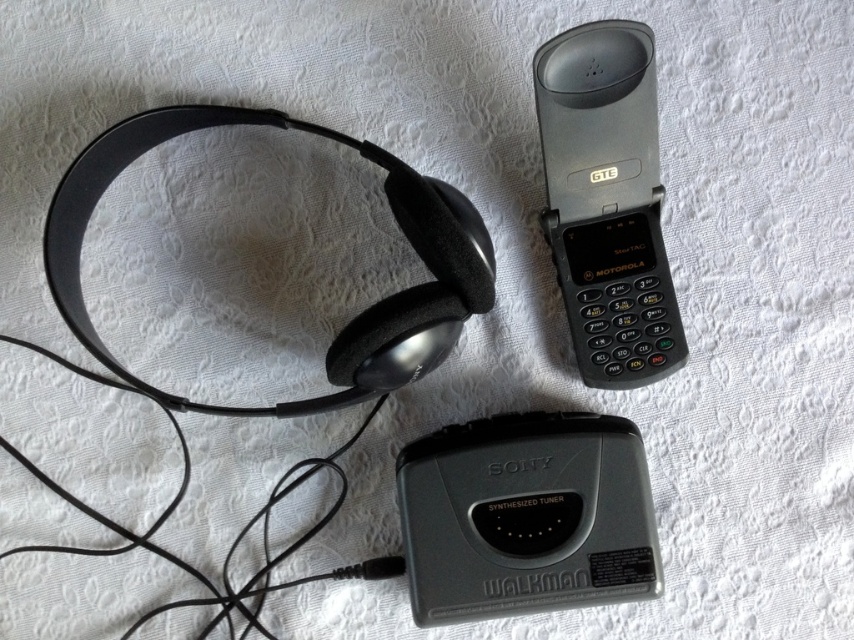
Question: Is gray matte walkman at center positioned before black plastic phone at upper right?

Choices:
 (A) no
 (B) yes

Answer: (A)

Question: Is gray matte walkman at center above matte black headphones at upper left?

Choices:
 (A) yes
 (B) no

Answer: (B)

Question: Which of these objects is positioned farthest from the gray matte walkman at center?

Choices:
 (A) matte black headphones at upper left
 (B) black plastic phone at upper right

Answer: (A)

Question: Which point is closer to the camera taking this photo?

Choices:
 (A) (560, 156)
 (B) (442, 260)

Answer: (A)

Question: Which point appears farthest from the camera in this image?

Choices:
 (A) (642, 131)
 (B) (401, 353)
 (C) (516, 516)

Answer: (C)

Question: Can you confirm if gray matte walkman at center is bigger than black plastic phone at upper right?

Choices:
 (A) no
 (B) yes

Answer: (A)